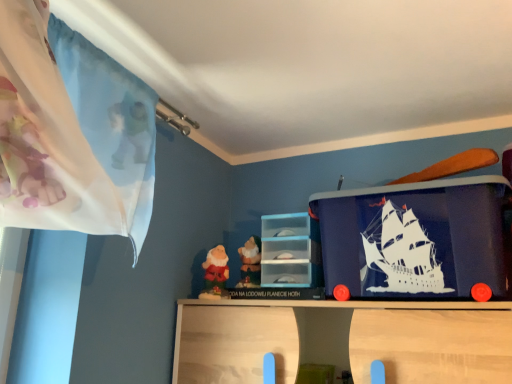
Question: Is point (215, 251) positioned closer to the camera than point (258, 269)?

Choices:
 (A) closer
 (B) farther

Answer: (B)

Question: In terms of size, does velvet red dwarf at center, which is counted as the 1th toy, starting from the left, appear bigger or smaller than matte plastic dwarf at center, the 1th toy from the right?

Choices:
 (A) big
 (B) small

Answer: (A)

Question: Estimate the real-world distances between objects in this image. Which object is closer to the matte plastic dwarf at center, marked as the second toy in a left-to-right arrangement?

Choices:
 (A) transparent plastic drawer at center
 (B) velvet red dwarf at center, placed as the second toy when sorted from right to left

Answer: (B)

Question: Estimate the real-world distances between objects in this image. Which object is closer to the velvet red dwarf at center, which is counted as the 1th toy, starting from the left?

Choices:
 (A) transparent plastic drawer at center
 (B) matte plastic dwarf at center, marked as the second toy in a left-to-right arrangement

Answer: (B)